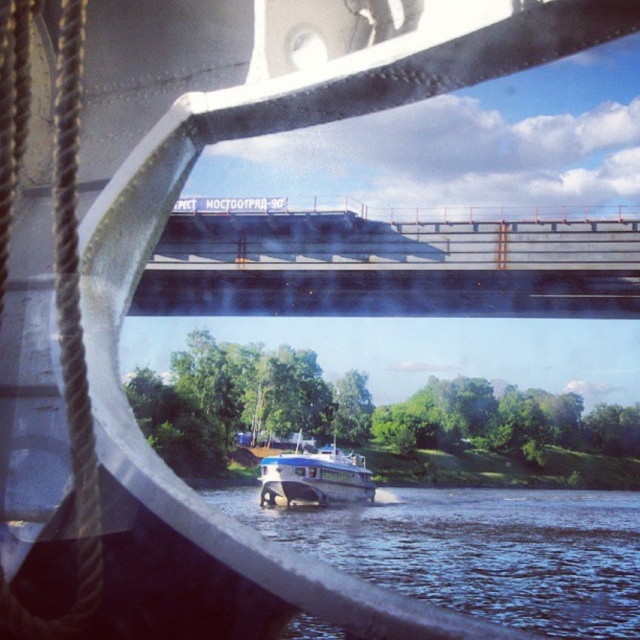
Who is lower down, blue water at lower center or blue glossy boat at center?

blue water at lower center

Between blue water at lower center and blue glossy boat at center, which one has more height?

With more height is blue water at lower center.

Which is behind, point (595, 508) or point (292, 504)?

Positioned behind is point (595, 508).

At what (x,y) coordinates should I click in order to perform the action: click on blue water at lower center. Please return your answer as a coordinate pair (x, y). Image resolution: width=640 pixels, height=640 pixels. Looking at the image, I should click on (481, 552).

Between concrete bridge at center and blue glossy boat at center, which one is positioned lower?

blue glossy boat at center is lower down.

Can you confirm if concrete bridge at center is smaller than blue glossy boat at center?

Actually, concrete bridge at center might be larger than blue glossy boat at center.

This screenshot has height=640, width=640. What do you see at coordinates (390, 266) in the screenshot?
I see `concrete bridge at center` at bounding box center [390, 266].

At what (x,y) coordinates should I click in order to perform the action: click on concrete bridge at center. Please return your answer as a coordinate pair (x, y). The height and width of the screenshot is (640, 640). Looking at the image, I should click on (390, 266).

Between concrete bridge at center and blue water at lower center, which one is positioned lower?

blue water at lower center is below.

Who is positioned more to the right, concrete bridge at center or blue water at lower center?

Positioned to the right is blue water at lower center.

Is point (273, 246) less distant than point (406, 586)?

No, it is not.

I want to click on concrete bridge at center, so click(x=390, y=266).